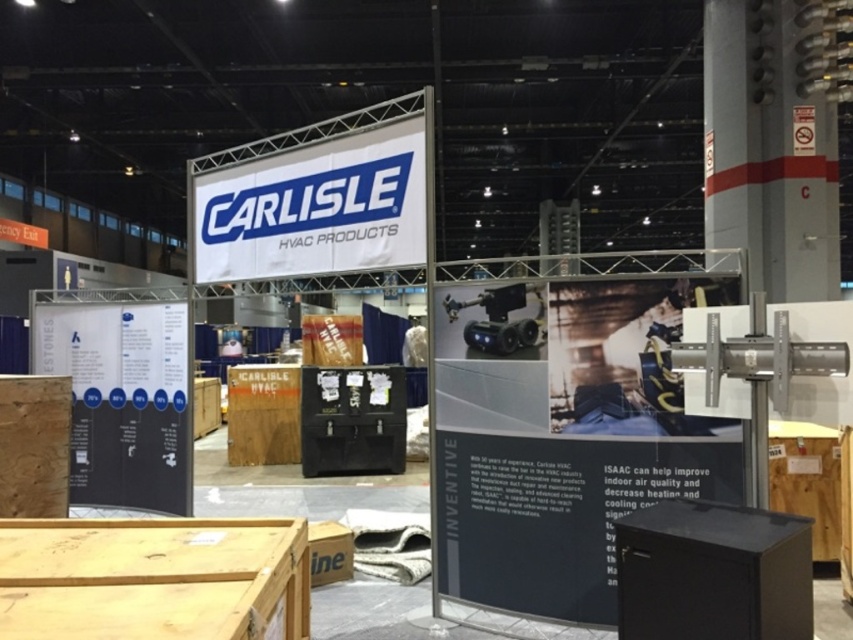
In the scene shown: Who is taller, metallic gray pole at upper right or white fabric banner at upper center?

With more height is metallic gray pole at upper right.

Can you confirm if metallic gray pole at upper right is positioned above white fabric banner at upper center?

Yes, metallic gray pole at upper right is above white fabric banner at upper center.

Between point (780, 84) and point (410, 225), which one is positioned behind?

Positioned behind is point (780, 84).

This screenshot has width=853, height=640. Find the location of `metallic gray pole at upper right`. metallic gray pole at upper right is located at coordinates (769, 150).